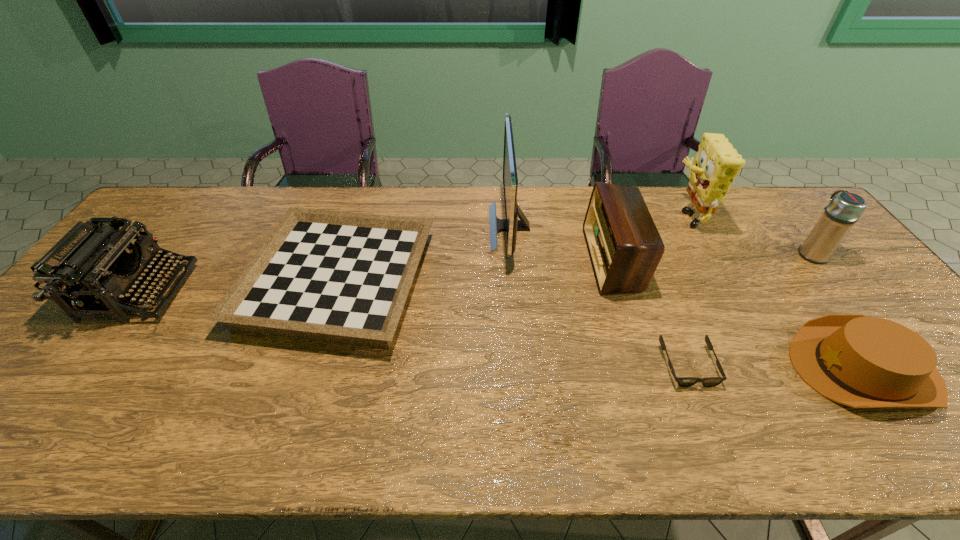
Where is `free space at the near edge of the desktop`? free space at the near edge of the desktop is located at coordinates (852, 455).

Identify the location of blank space at the far left corner of the desktop. The height and width of the screenshot is (540, 960). (198, 208).

Find the location of `vacant space at the near left corner of the desktop`. vacant space at the near left corner of the desktop is located at coordinates (2, 456).

The height and width of the screenshot is (540, 960). In the image, there is a desktop. Identify the location of vacant space at the far right corner. (762, 198).

The width and height of the screenshot is (960, 540). Identify the location of free spot between the seventh tallest object and the thermos bottle. (575, 267).

You are a GUI agent. You are given a task and a screenshot of the screen. Output one action in this format:
    pyautogui.click(x=<x>, y=<y>)
    Task: Click on the empty location between the thermos bottle and the sixth object from left to right
    This screenshot has width=960, height=540.
    Given the screenshot: What is the action you would take?
    pyautogui.click(x=749, y=234)

Locate an element on the screen. free area in between the radio receiver and the thermos bottle is located at coordinates (712, 256).

I want to click on unoccupied position between the sunglasses and the third object from left to right, so click(x=599, y=296).

You are a GUI agent. You are given a task and a screenshot of the screen. Output one action in this format:
    pyautogui.click(x=<x>, y=<y>)
    Task: Click on the unoccupied area between the third object from right to left and the thermos bottle
    
    Given the screenshot: What is the action you would take?
    pyautogui.click(x=749, y=234)

Identify the location of vacant space that's between the seventh object from right to left and the radio receiver. (475, 269).